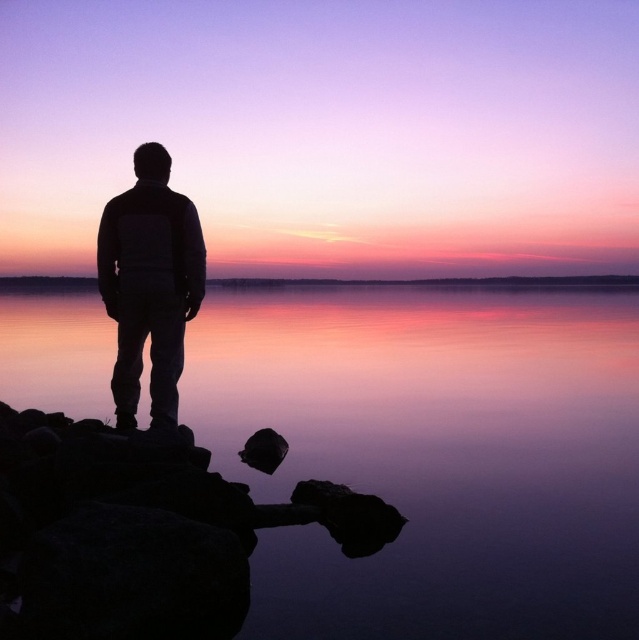
You are an artist trying to paint the sunset scene. You want to ensure the silhouette jacket at center is proportionally smaller than the smooth water at center. Does the current arrangement allow this?

Yes, the smooth water at center is bigger than the silhouette jacket at center, so the current arrangement allows the silhouette jacket at center to be proportionally smaller than the smooth water at center.

You are standing on the rocky outcrop and want to take a photo of the silhouette jacket at center and the smooth water at center. Which object should you focus on first to ensure both are in the frame?

You should focus on the silhouette jacket at center first because it is behind the smooth water at center, so adjusting the focus to include the jacket will naturally include the water in front of it.

You are a photographer planning to capture the sunset reflection on the smooth water at center. Based on the coordinates provided, where should you position your camera to ensure the reflection is centered in your shot?

The smooth water at center is located at coordinates point (435, 454), so you should position your camera directly facing that point to center the reflection in your shot.